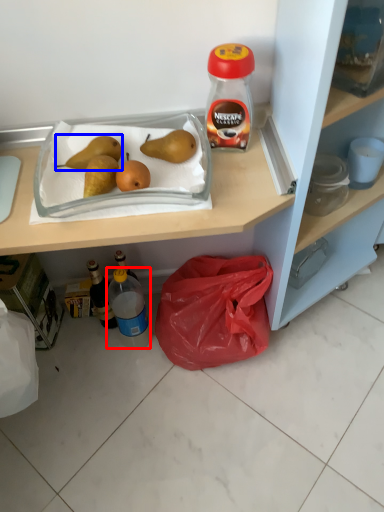
Question: Among these objects, which one is farthest to the camera, bottle (highlighted by a red box) or pear (highlighted by a blue box)?

Choices:
 (A) bottle
 (B) pear

Answer: (A)